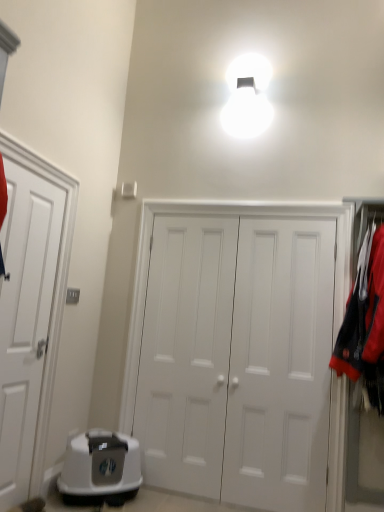
Question: Is the position of white plastic litter box at lower left more distant than that of white matte door at center, arranged as the first door when viewed from the right?

Choices:
 (A) no
 (B) yes

Answer: (A)

Question: Is white matte door at center, which is counted as the 3th door, starting from the left, a part of white plastic litter box at lower left?

Choices:
 (A) yes
 (B) no

Answer: (B)

Question: Does white plastic litter box at lower left appear on the right side of white matte door at center, which is counted as the 3th door, starting from the left?

Choices:
 (A) no
 (B) yes

Answer: (A)

Question: Would you say white plastic litter box at lower left is a long distance from white matte door at center, which is counted as the 3th door, starting from the left?

Choices:
 (A) no
 (B) yes

Answer: (A)

Question: Is white plastic litter box at lower left bigger than white matte door at center, which is counted as the 3th door, starting from the left?

Choices:
 (A) yes
 (B) no

Answer: (B)

Question: Is white plastic litter box at lower left closer to the viewer compared to white matte door at center, which is counted as the 3th door, starting from the left?

Choices:
 (A) yes
 (B) no

Answer: (A)

Question: Is white plastic litter box at lower left surrounding white matte door at left, marked as the first door in a left-to-right arrangement?

Choices:
 (A) no
 (B) yes

Answer: (A)

Question: From a real-world perspective, is white plastic litter box at lower left beneath white matte door at left, marked as the first door in a left-to-right arrangement?

Choices:
 (A) no
 (B) yes

Answer: (B)

Question: Does white plastic litter box at lower left appear on the left side of white matte door at left, marked as the first door in a left-to-right arrangement?

Choices:
 (A) no
 (B) yes

Answer: (A)

Question: Considering the relative sizes of white plastic litter box at lower left and white matte door at left, marked as the first door in a left-to-right arrangement, in the image provided, is white plastic litter box at lower left taller than white matte door at left, marked as the first door in a left-to-right arrangement,?

Choices:
 (A) yes
 (B) no

Answer: (B)

Question: Is white matte door at left, marked as the first door in a left-to-right arrangement, at the back of white plastic litter box at lower left?

Choices:
 (A) yes
 (B) no

Answer: (B)

Question: Is white plastic litter box at lower left shorter than white matte door at left, marked as the first door in a left-to-right arrangement?

Choices:
 (A) yes
 (B) no

Answer: (A)

Question: Can you confirm if white matte door at center, which is counted as the 3th door, starting from the left, is bigger than white matte door at left, marked as the first door in a left-to-right arrangement?

Choices:
 (A) yes
 (B) no

Answer: (A)